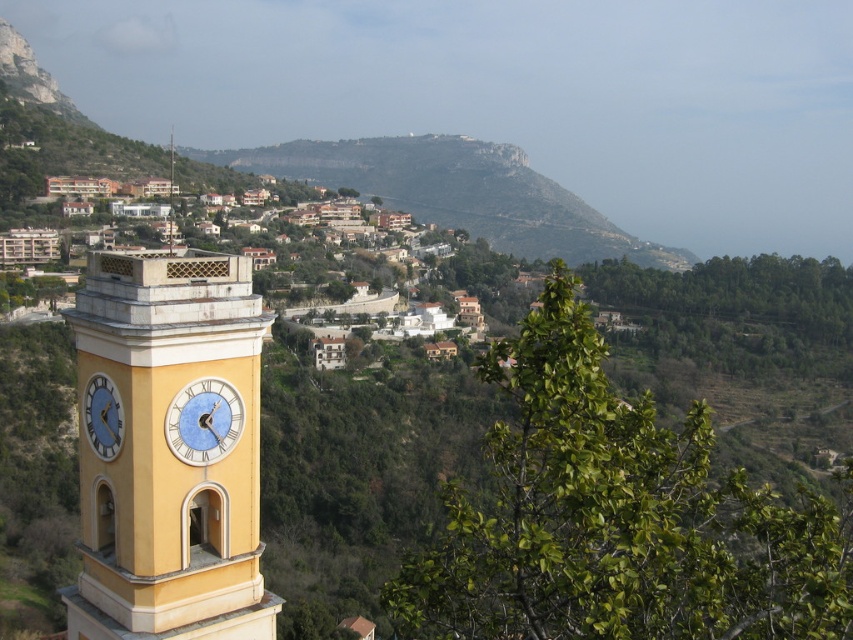
The image size is (853, 640). Find the location of `blue glass clock at center`. blue glass clock at center is located at coordinates (202, 420).

Does blue glass clock at center have a lesser height compared to white glossy clock at left?

No.

Between point (186, 449) and point (115, 451), which one is positioned behind?

The point (186, 449) is behind.

I want to click on blue glass clock at center, so click(x=202, y=420).

Between green rocky mountain at upper center and blue glass clock at center, which one is positioned lower?

blue glass clock at center is below.

Who is more forward, (454, 154) or (241, 422)?

Positioned in front is point (241, 422).

In order to click on green rocky mountain at upper center in this screenshot , I will do `click(457, 193)`.

Can you confirm if yellow painted stone clock tower at left is positioned to the left of blue glass clock at center?

Indeed, yellow painted stone clock tower at left is positioned on the left side of blue glass clock at center.

Which of these two, yellow painted stone clock tower at left or blue glass clock at center, stands taller?

yellow painted stone clock tower at left is taller.

Image resolution: width=853 pixels, height=640 pixels. Describe the element at coordinates (171, 449) in the screenshot. I see `yellow painted stone clock tower at left` at that location.

Find the location of `yellow painted stone clock tower at left`. yellow painted stone clock tower at left is located at coordinates click(x=171, y=449).